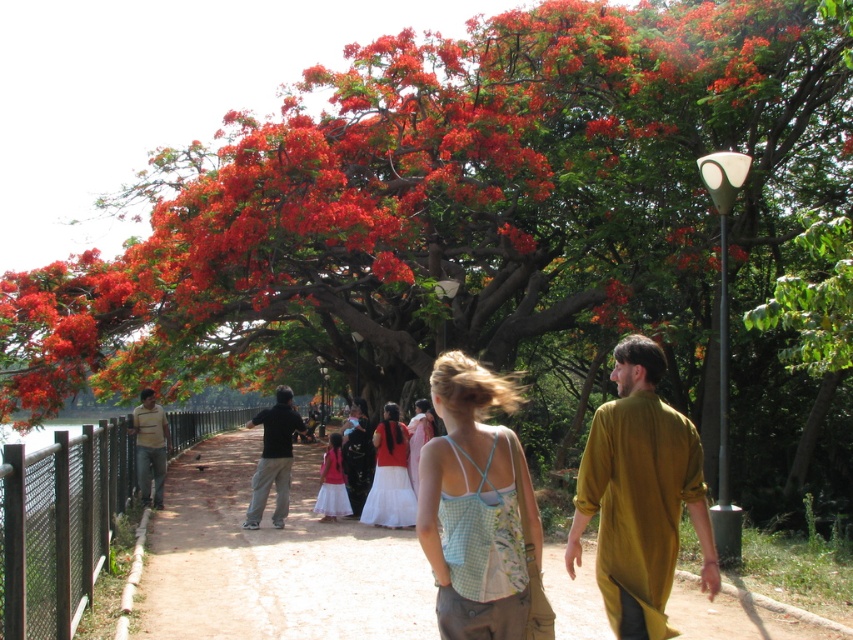
Question: Based on their relative distances, which object is farther from the mustard silk shirt at right?

Choices:
 (A) light brown cotton shirt at left
 (B) brown dirt path at center
 (C) light blue gingham tank top at center
 (D) black cotton shirt at center

Answer: (A)

Question: Can you confirm if mustard silk shirt at right is smaller than black cotton shirt at center?

Choices:
 (A) no
 (B) yes

Answer: (B)

Question: Which of these objects is positioned closest to the light brown cotton shirt at left?

Choices:
 (A) light blue gingham tank top at center
 (B) brown dirt path at center

Answer: (B)

Question: Estimate the real-world distances between objects in this image. Which object is closer to the light brown cotton shirt at left?

Choices:
 (A) black cotton shirt at center
 (B) light blue gingham tank top at center
 (C) brown dirt path at center

Answer: (A)

Question: Is mustard silk shirt at right closer to camera compared to white cotton skirt at center?

Choices:
 (A) yes
 (B) no

Answer: (A)

Question: Does light blue gingham tank top at center come behind light brown cotton shirt at left?

Choices:
 (A) yes
 (B) no

Answer: (B)